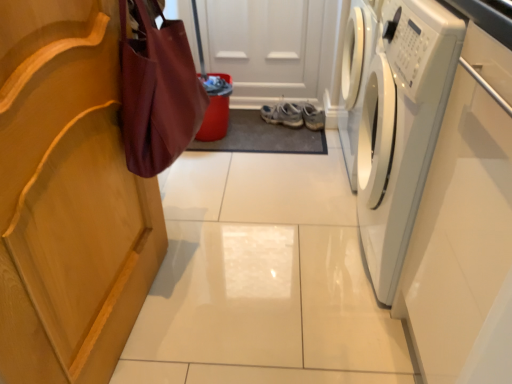
Identify the location of free region under burgundy fabric bag at left (from a real-world perspective). (196, 250).